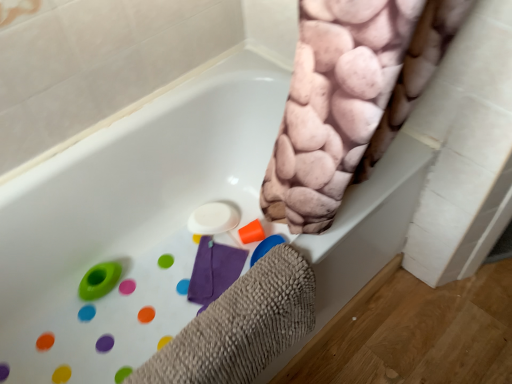
Where is `empty space that is ontop of beige microfiber towel at lower center (from a real-world perspective)`? The image size is (512, 384). empty space that is ontop of beige microfiber towel at lower center (from a real-world perspective) is located at coordinates (229, 313).